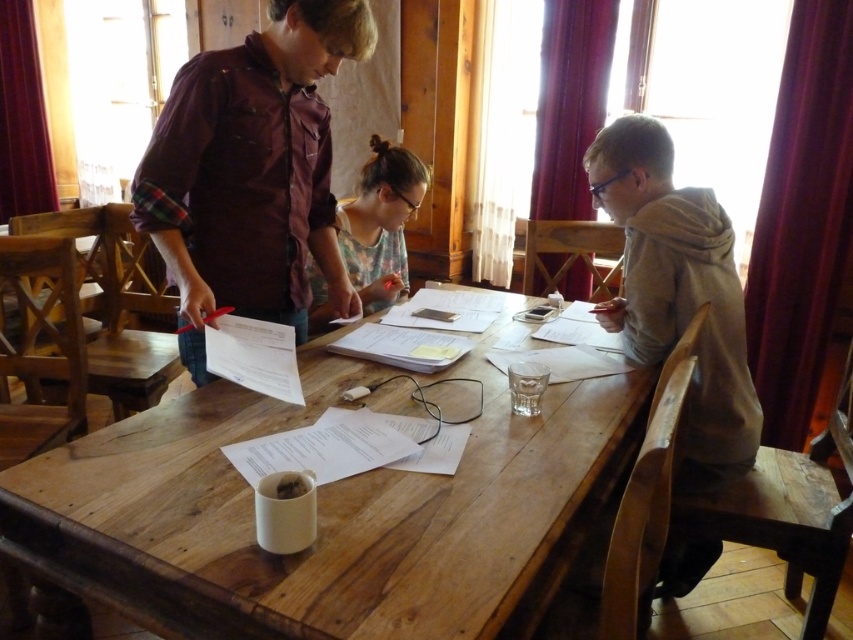
Question: Is gray matte hoodie at right thinner than floral fabric shirt at center?

Choices:
 (A) no
 (B) yes

Answer: (A)

Question: Which point is closer to the camera?

Choices:
 (A) (485, 508)
 (B) (637, 342)
 (C) (299, 12)

Answer: (A)

Question: Which point appears closest to the camera in this image?

Choices:
 (A) (389, 145)
 (B) (274, 426)
 (C) (194, 221)
 (D) (637, 321)

Answer: (B)

Question: Does wooden table at center appear under floral fabric shirt at center?

Choices:
 (A) yes
 (B) no

Answer: (A)

Question: Among these points, which one is nearest to the camera?

Choices:
 (A) (141, 545)
 (B) (257, 134)

Answer: (A)

Question: Does maroon plaid shirt at center lie behind floral fabric shirt at center?

Choices:
 (A) yes
 (B) no

Answer: (B)